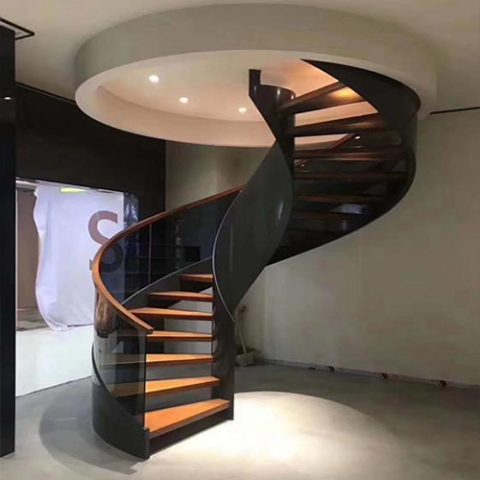
This screenshot has width=480, height=480. Identify the location of white sheet. (66, 294), (64, 206), (106, 203).